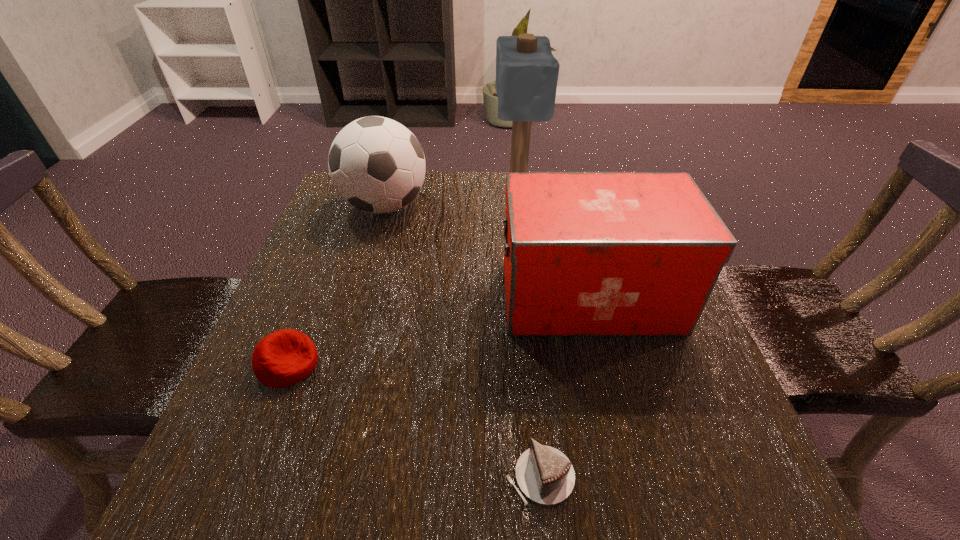
Find the location of a particular element. object that is at the far left corner is located at coordinates (377, 165).

This screenshot has width=960, height=540. In order to click on vacant space at the far edge in this screenshot , I will do `click(439, 171)`.

The height and width of the screenshot is (540, 960). Find the location of `vacant area at the near edge of the desktop`. vacant area at the near edge of the desktop is located at coordinates (319, 510).

Where is `vacant region at the left edge of the desktop`? vacant region at the left edge of the desktop is located at coordinates (254, 453).

Where is `free space that is in between the fourth tallest object and the shortest object`? The height and width of the screenshot is (540, 960). free space that is in between the fourth tallest object and the shortest object is located at coordinates 414,420.

You are a GUI agent. You are given a task and a screenshot of the screen. Output one action in this format:
    pyautogui.click(x=<x>, y=<y>)
    Task: Click on the free spot between the nearest object and the fourth farthest object
    This screenshot has height=540, width=960.
    Given the screenshot: What is the action you would take?
    pyautogui.click(x=414, y=420)

You are a GUI agent. You are given a task and a screenshot of the screen. Output one action in this format:
    pyautogui.click(x=<x>, y=<y>)
    Task: Click on the free space between the second nearest object and the soccer ball
    The image size is (960, 540).
    Given the screenshot: What is the action you would take?
    pyautogui.click(x=336, y=286)

At what (x,y) coordinates should I click in order to perform the action: click on empty space that is in between the soccer ball and the second nearest object. Please return your answer as a coordinate pair (x, y). This screenshot has width=960, height=540. Looking at the image, I should click on (336, 286).

This screenshot has width=960, height=540. In order to click on vacant region between the mallet and the beanbag in this screenshot , I will do `click(402, 278)`.

I want to click on vacant space that is in between the third nearest object and the chocolate cake, so click(x=564, y=387).